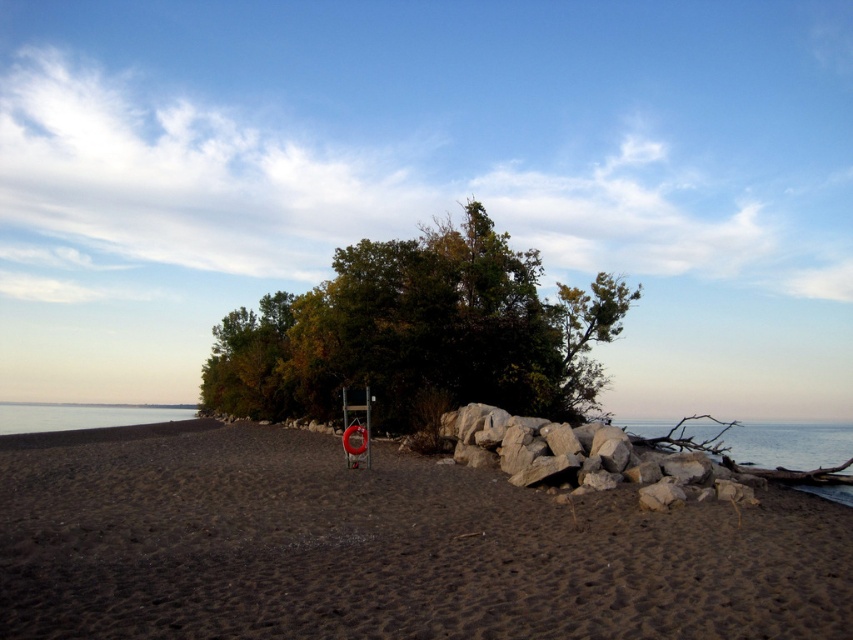
Question: Can you confirm if dark brown sand at center is smaller than clear water at lower right?

Choices:
 (A) yes
 (B) no

Answer: (A)

Question: Which object is positioned farthest from the green leafy tree at center?

Choices:
 (A) clear water at lower right
 (B) dark brown sand at center

Answer: (A)

Question: Does dark brown sand at center have a larger size compared to clear water at lower right?

Choices:
 (A) no
 (B) yes

Answer: (A)

Question: Is dark brown sand at center bigger than clear water at lower right?

Choices:
 (A) no
 (B) yes

Answer: (A)

Question: Estimate the real-world distances between objects in this image. Which object is closer to the dark brown sand at center?

Choices:
 (A) green leafy tree at center
 (B) clear water at lower right

Answer: (A)

Question: Among these points, which one is nearest to the camera?

Choices:
 (A) (241, 316)
 (B) (814, 436)
 (C) (169, 612)

Answer: (C)